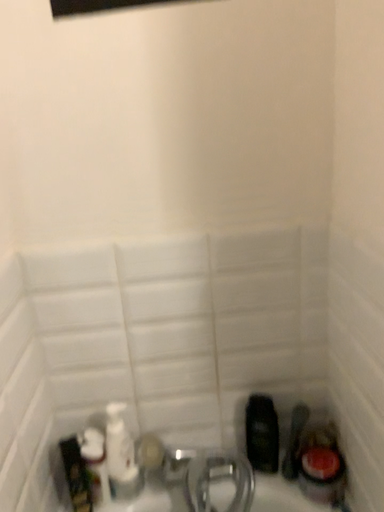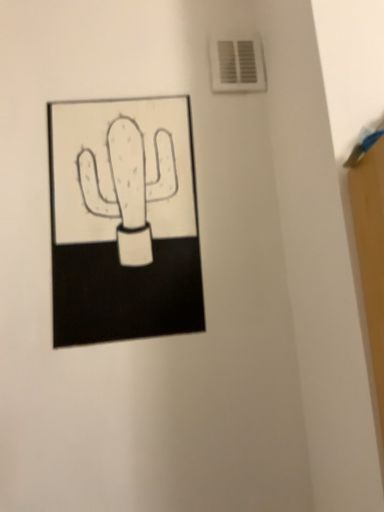
Question: Which way did the camera rotate in the video?

Choices:
 (A) rotated downward
 (B) rotated upward

Answer: (B)